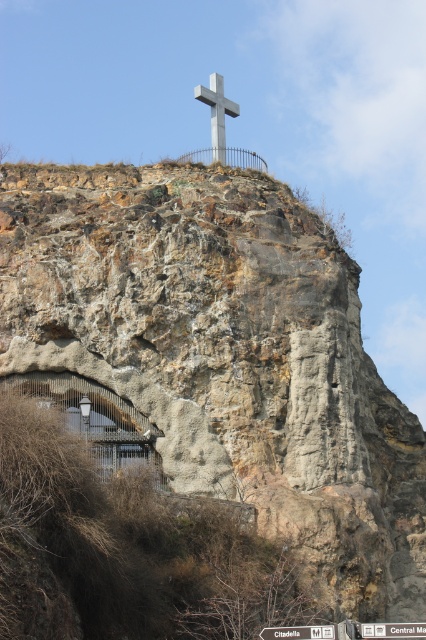
In the scene shown: Which of these two, white plastic signpost at upper center or white plastic street sign at upper center, stands taller?

With more height is white plastic street sign at upper center.

Can you confirm if white plastic signpost at upper center is positioned to the right of white plastic street sign at upper center?

In fact, white plastic signpost at upper center is to the left of white plastic street sign at upper center.

Who is more forward, (x=279, y=632) or (x=400, y=632)?

Point (x=400, y=632) is in front.

Where is `white plastic signpost at upper center`? The image size is (426, 640). white plastic signpost at upper center is located at coordinates (299, 632).

Between metallic cross at upper center and white plastic street sign at upper center, which one has more height?

metallic cross at upper center

Does point (218, 113) lie in front of point (367, 625)?

No, it is behind (367, 625).

Find the location of `metallic cross at upper center`. metallic cross at upper center is located at coordinates (216, 113).

Which is below, metallic cross at upper center or white plastic signpost at upper center?

white plastic signpost at upper center is below.

How much distance is there between metallic cross at upper center and white plastic signpost at upper center?

The distance of metallic cross at upper center from white plastic signpost at upper center is 177.47 feet.

Identify the location of metallic cross at upper center. (216, 113).